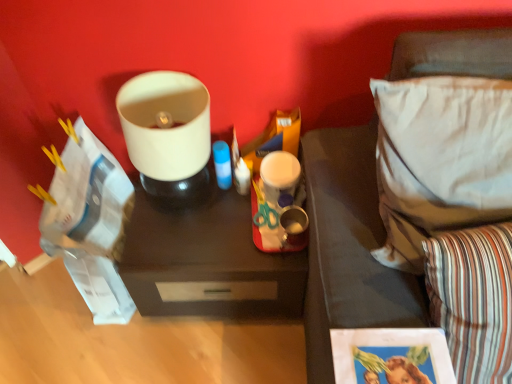
Question: Can we say matte white lampshade at upper center lies outside dark wood tray at center?

Choices:
 (A) no
 (B) yes

Answer: (B)

Question: Is matte white lampshade at upper center far from dark wood tray at center?

Choices:
 (A) yes
 (B) no

Answer: (B)

Question: Can you confirm if matte white lampshade at upper center is positioned to the left of dark wood tray at center?

Choices:
 (A) yes
 (B) no

Answer: (A)

Question: From the image's perspective, is matte white lampshade at upper center above dark wood tray at center?

Choices:
 (A) yes
 (B) no

Answer: (A)

Question: From a real-world perspective, is matte white lampshade at upper center located beneath dark wood tray at center?

Choices:
 (A) no
 (B) yes

Answer: (A)

Question: In terms of size, does dark wood tray at center appear bigger or smaller than white fabric pillow at right, the first pillow viewed from the top?

Choices:
 (A) small
 (B) big

Answer: (B)

Question: From the image's perspective, is dark wood tray at center positioned above or below white fabric pillow at right, the first pillow viewed from the top?

Choices:
 (A) below
 (B) above

Answer: (A)

Question: Relative to white fabric pillow at right, the first pillow viewed from the top, is dark wood tray at center in front or behind?

Choices:
 (A) behind
 (B) front

Answer: (A)

Question: Is dark wood tray at center wider or thinner than white fabric pillow at right, the first pillow viewed from the top?

Choices:
 (A) thin
 (B) wide

Answer: (B)

Question: In the image, is striped fabric pillow at lower right, the second pillow in the top-to-bottom sequence, positioned in front of or behind white fabric pillow at right, the 2th pillow in the bottom-to-top sequence?

Choices:
 (A) front
 (B) behind

Answer: (A)

Question: Is point (433, 317) closer or farther from the camera than point (410, 168)?

Choices:
 (A) closer
 (B) farther

Answer: (A)

Question: Is striped fabric pillow at lower right, the second pillow in the top-to-bottom sequence, taller or shorter than white fabric pillow at right, the first pillow viewed from the top?

Choices:
 (A) short
 (B) tall

Answer: (B)

Question: Considering the relative positions of striped fabric pillow at lower right, arranged as the 1th pillow when ordered from the bottom, and white fabric pillow at right, the first pillow viewed from the top, in the image provided, is striped fabric pillow at lower right, arranged as the 1th pillow when ordered from the bottom, to the left or to the right of white fabric pillow at right, the first pillow viewed from the top,?

Choices:
 (A) right
 (B) left

Answer: (A)

Question: Is white fabric pillow at right, the 2th pillow in the bottom-to-top sequence, to the left or to the right of matte white lampshade at upper center in the image?

Choices:
 (A) right
 (B) left

Answer: (A)

Question: Looking at the image, does white fabric pillow at right, the first pillow viewed from the top, seem bigger or smaller compared to matte white lampshade at upper center?

Choices:
 (A) small
 (B) big

Answer: (B)